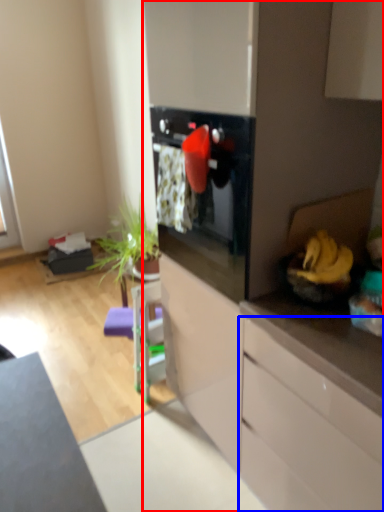
Question: Which object appears farthest to the camera in this image, dresser (highlighted by a red box) or cabinetry (highlighted by a blue box)?

Choices:
 (A) dresser
 (B) cabinetry

Answer: (A)